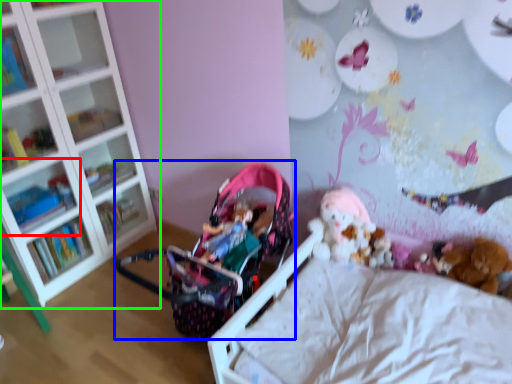
Question: Based on their relative distances, which object is nearer to shelf (highlighted by a red box)? Choose from baby carriage (highlighted by a blue box) and shelf (highlighted by a green box).

Choices:
 (A) baby carriage
 (B) shelf

Answer: (B)